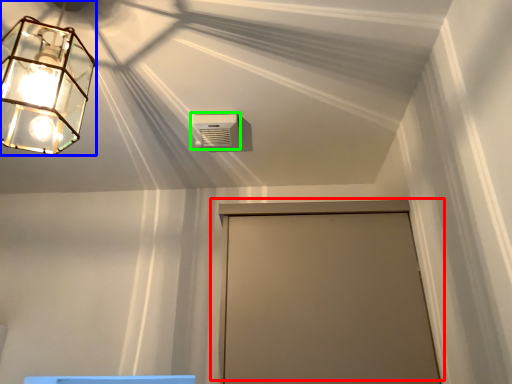
Question: Based on their relative distances, which object is farther from door (highlighted by a red box)? Choose from lamp (highlighted by a blue box) and air conditioning (highlighted by a green box).

Choices:
 (A) lamp
 (B) air conditioning

Answer: (A)